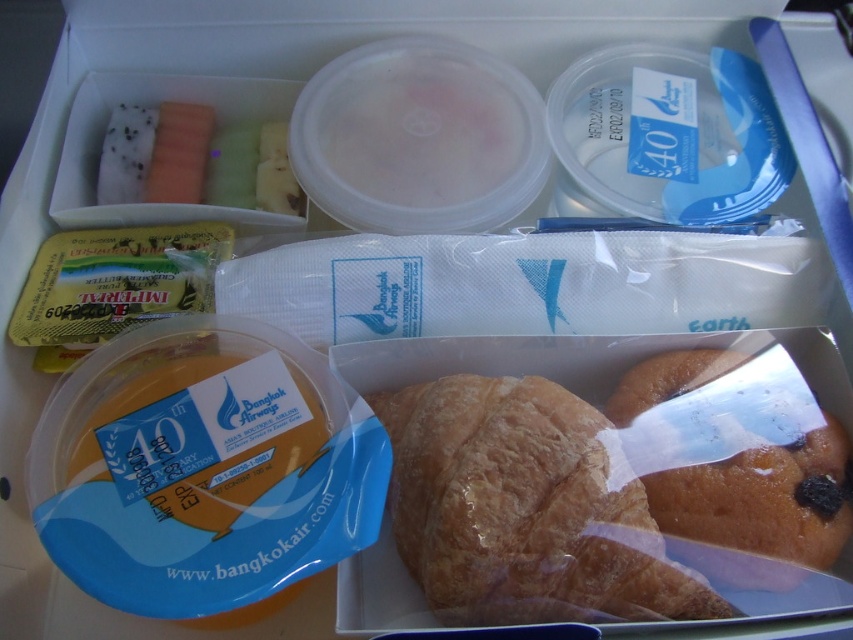
Based on the provided scene description, what is the exact location of the golden brown flaky croissant at center?

The golden brown flaky croissant at center is located at point (x=523, y=509).